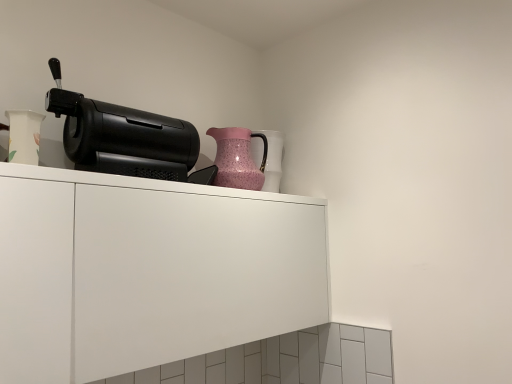
Question: From a real-world perspective, does white matte cabinet at upper center stand above pink speckled glass jug at upper right?

Choices:
 (A) no
 (B) yes

Answer: (A)

Question: Is white matte cabinet at upper center bigger than pink speckled glass jug at upper right?

Choices:
 (A) no
 (B) yes

Answer: (B)

Question: Can you confirm if white matte cabinet at upper center is positioned to the left of pink speckled glass jug at upper right?

Choices:
 (A) yes
 (B) no

Answer: (A)

Question: Does white matte cabinet at upper center appear on the right side of pink speckled glass jug at upper right?

Choices:
 (A) no
 (B) yes

Answer: (A)

Question: From a real-world perspective, does white matte cabinet at upper center sit lower than pink speckled glass jug at upper right?

Choices:
 (A) yes
 (B) no

Answer: (A)

Question: Is pink speckled glass jug at upper right taller or shorter than black plastic coffee machine at upper left?

Choices:
 (A) tall
 (B) short

Answer: (A)

Question: Considering their positions, is pink speckled glass jug at upper right located in front of or behind black plastic coffee machine at upper left?

Choices:
 (A) front
 (B) behind

Answer: (B)

Question: In the image, is pink speckled glass jug at upper right on the left side or the right side of black plastic coffee machine at upper left?

Choices:
 (A) left
 (B) right

Answer: (B)

Question: From the image's perspective, is pink speckled glass jug at upper right above or below black plastic coffee machine at upper left?

Choices:
 (A) above
 (B) below

Answer: (B)

Question: Looking at their shapes, would you say pink speckled glass jug at upper right is wider or thinner than pink textured vase at upper center, placed as the 2th vase when sorted from left to right?

Choices:
 (A) thin
 (B) wide

Answer: (B)

Question: Is pink speckled glass jug at upper right to the left or to the right of pink textured vase at upper center, placed as the 2th vase when sorted from left to right, in the image?

Choices:
 (A) right
 (B) left

Answer: (B)

Question: Is point (252, 165) positioned closer to the camera than point (271, 188)?

Choices:
 (A) farther
 (B) closer

Answer: (B)

Question: Considering their positions, is pink speckled glass jug at upper right located in front of or behind pink textured vase at upper center, positioned as the second vase in front-to-back order?

Choices:
 (A) behind
 (B) front

Answer: (B)

Question: From a real-world perspective, relative to white matte cabinet at upper center, is pink speckled glass jug at upper right vertically above or below?

Choices:
 (A) above
 (B) below

Answer: (A)

Question: Considering the positions of point (263, 162) and point (234, 342), is point (263, 162) closer or farther from the camera than point (234, 342)?

Choices:
 (A) closer
 (B) farther

Answer: (B)